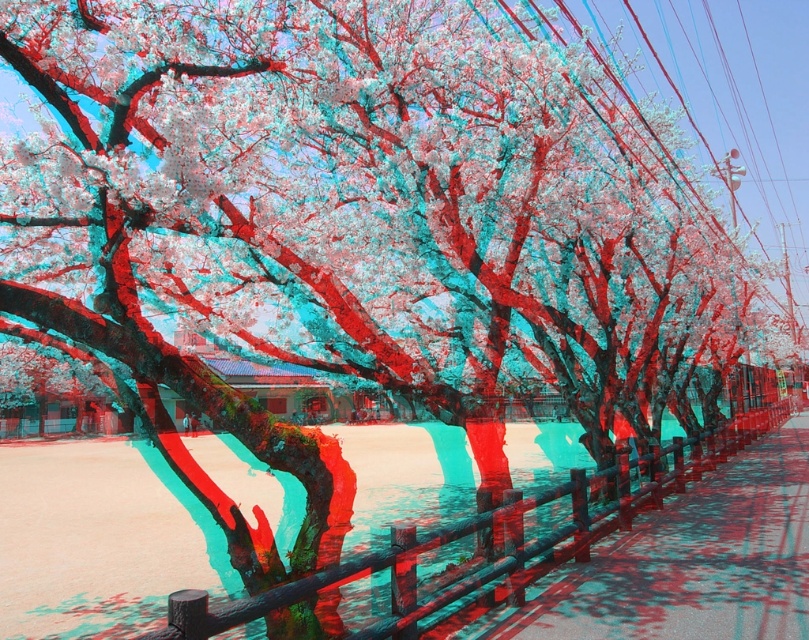
Question: Which point appears closest to the camera in this image?

Choices:
 (A) (625, 458)
 (B) (744, 468)

Answer: (A)

Question: Which of the following is the farthest from the observer?

Choices:
 (A) wooden fence at center
 (B) smooth concrete pavement at center

Answer: (B)

Question: Is the position of smooth concrete pavement at center more distant than that of wooden fence at center?

Choices:
 (A) yes
 (B) no

Answer: (A)

Question: Is smooth concrete pavement at center positioned in front of wooden fence at center?

Choices:
 (A) yes
 (B) no

Answer: (B)

Question: Does smooth concrete pavement at center appear under wooden fence at center?

Choices:
 (A) no
 (B) yes

Answer: (A)